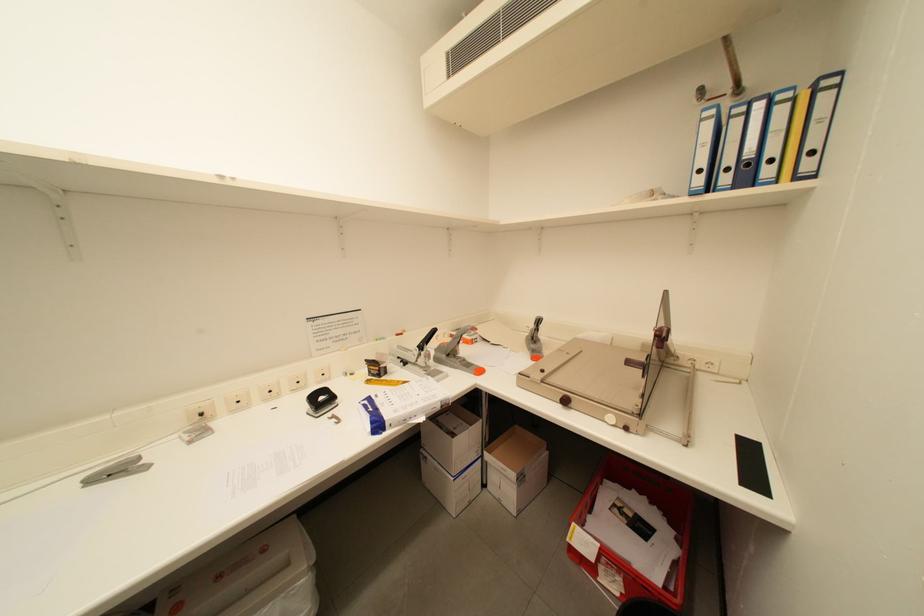
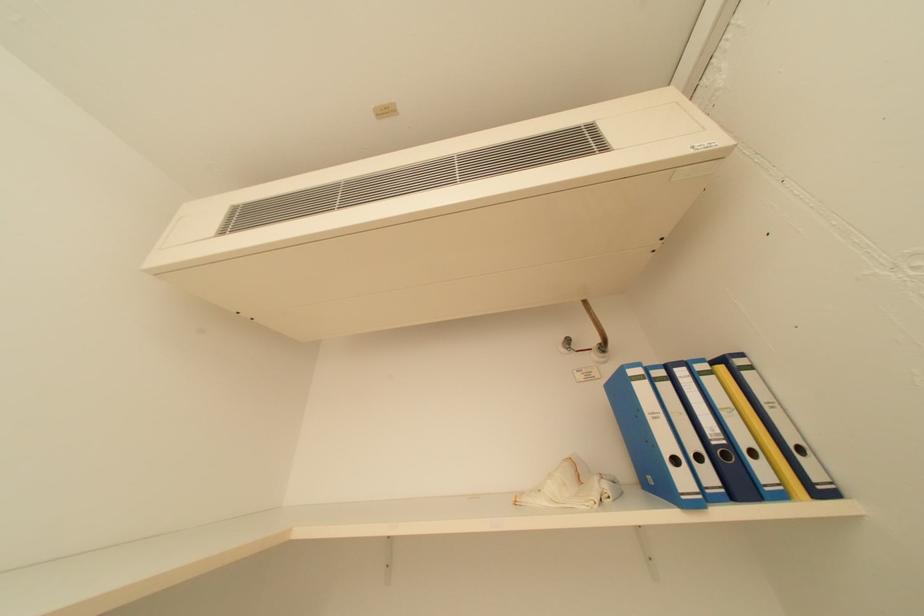
The first image is from the beginning of the video and the second image is from the end. How did the camera likely rotate when shooting the video?

The camera's rotation is toward right-up.